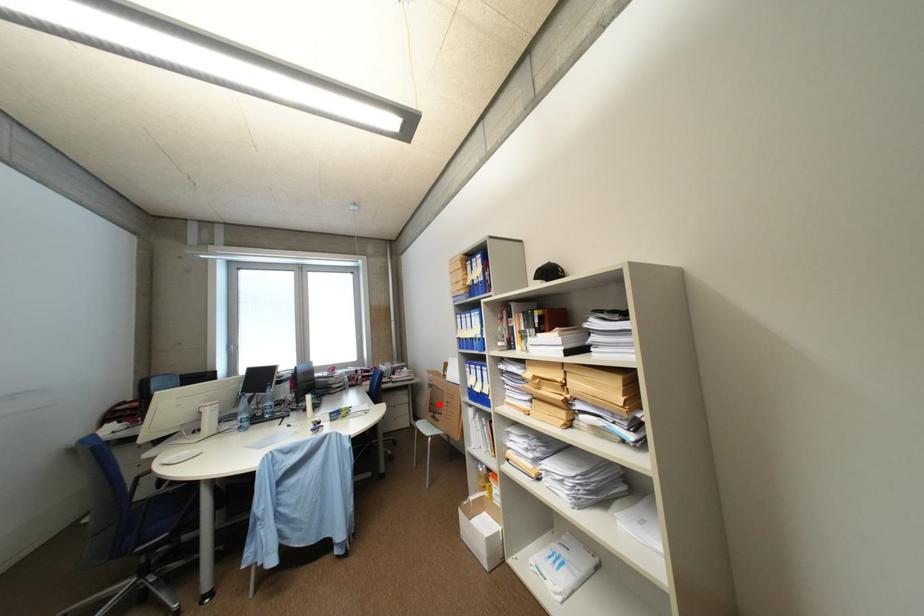
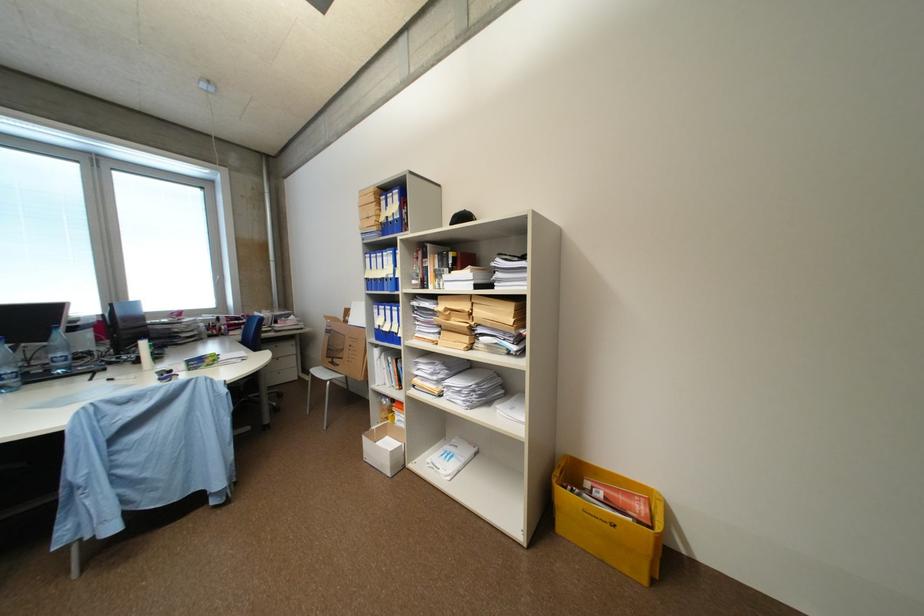
Question: I am providing you with two images of the same scene from different viewpoints. Image1 has a red point marked. In image2, the corresponding 3D location appears at what relative position? Reply with the corresponding letter.

Choices:
 (A) Closer
 (B) Farther

Answer: (A)